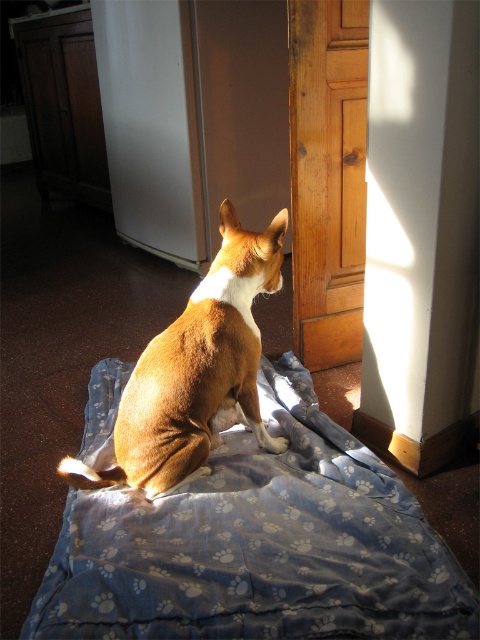
Question: Which object is closer to the camera taking this photo?

Choices:
 (A) brown furry dog at center
 (B) blue fabric sheet at center

Answer: (B)

Question: Does blue fabric sheet at center have a lesser width compared to brown furry dog at center?

Choices:
 (A) yes
 (B) no

Answer: (B)

Question: Does blue fabric sheet at center have a smaller size compared to brown furry dog at center?

Choices:
 (A) yes
 (B) no

Answer: (B)

Question: Does blue fabric sheet at center come in front of brown furry dog at center?

Choices:
 (A) yes
 (B) no

Answer: (A)

Question: Among these points, which one is nearest to the camera?

Choices:
 (A) (96, 579)
 (B) (197, 465)

Answer: (A)